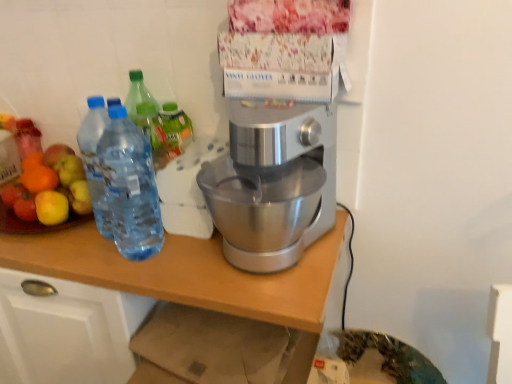
The image size is (512, 384). Find the location of `vacant area in front of transparent plastic bottles at left`. vacant area in front of transparent plastic bottles at left is located at coordinates (145, 279).